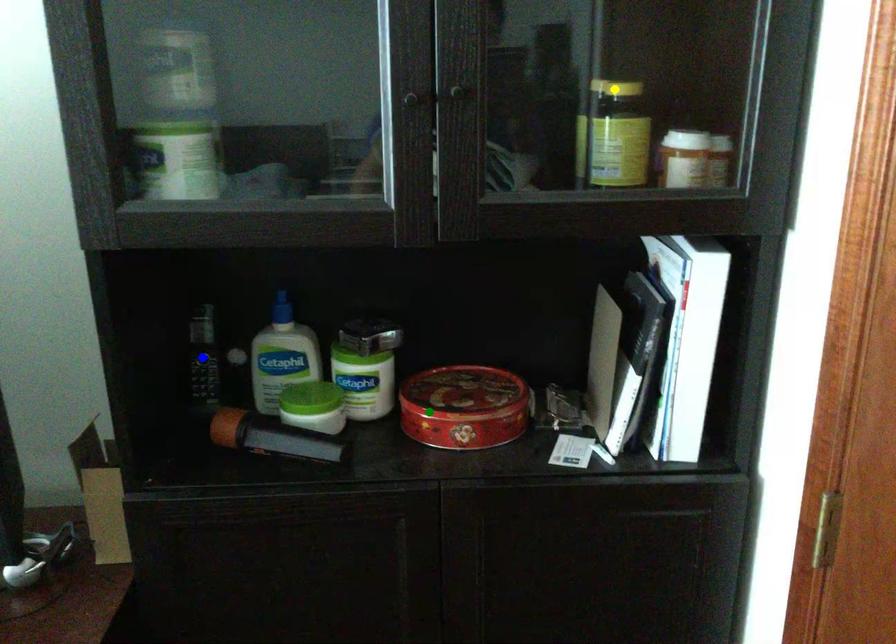
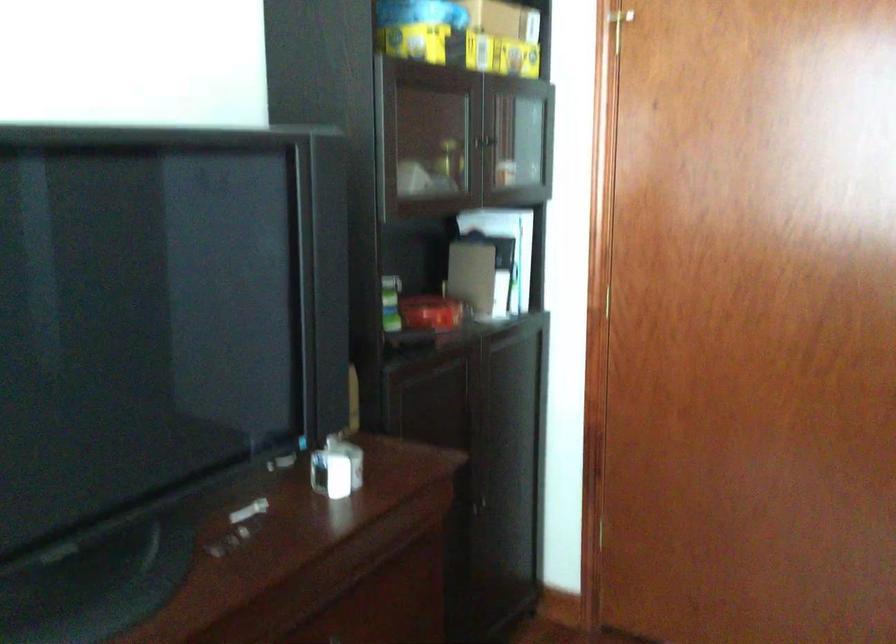
I am providing you with two images of the same scene from different viewpoints. Three points are marked in image1. Which point corresponds to a part or object that is occluded in image2?In image1, three points are marked. Which of them correspond to a part or object that is occluded in image2?Among the three points shown in image1, which one corresponds to a part or object that is no longer visible due to occlusion in image2?

blue point, yellow point cannot be seen in image2.